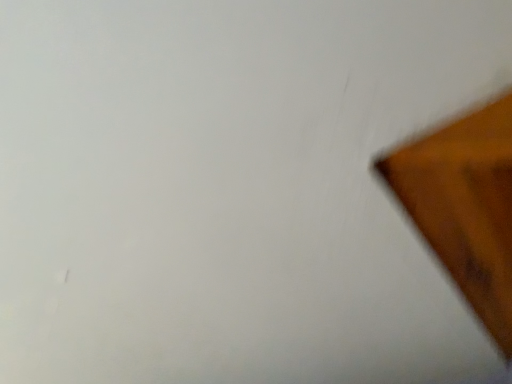
Describe the element at coordinates (465, 205) in the screenshot. The height and width of the screenshot is (384, 512). I see `brown wood table at right` at that location.

Identify the location of brown wood table at right. (465, 205).

This screenshot has height=384, width=512. Find the location of `brown wood table at right`. brown wood table at right is located at coordinates (465, 205).